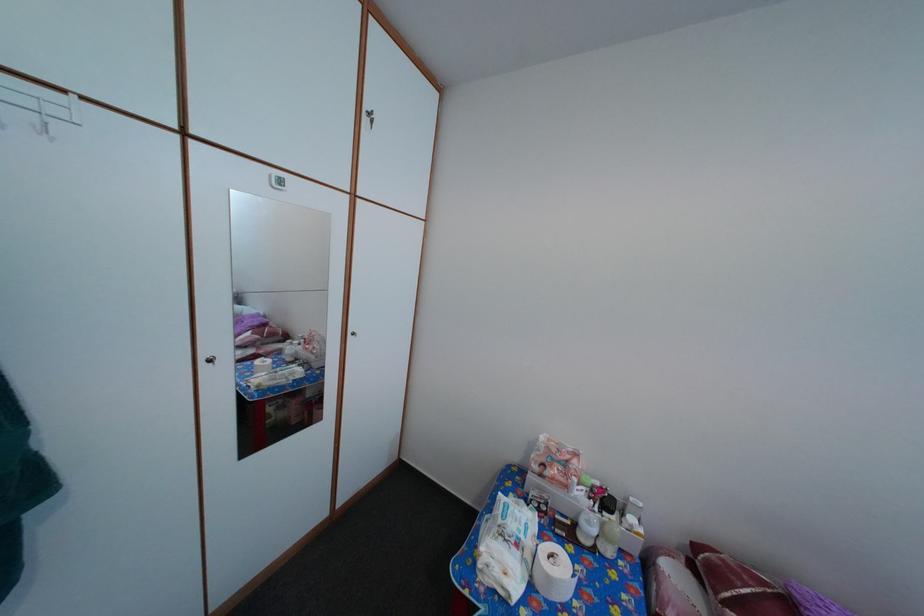
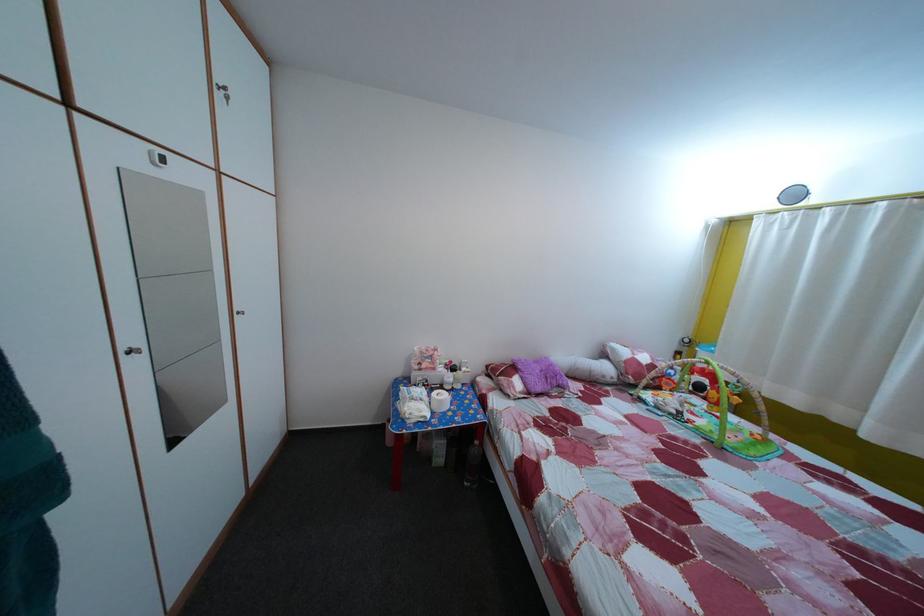
Question: The first image is from the beginning of the video and the second image is from the end. How did the camera likely rotate when shooting the video?

Choices:
 (A) Left
 (B) Right
 (C) Up
 (D) Down

Answer: (B)